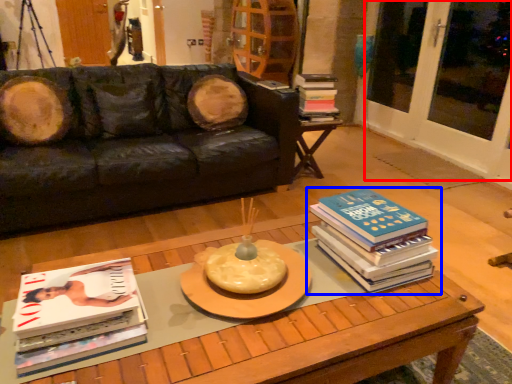
Question: Which object appears closest to the camera in this image, screen door (highlighted by a red box) or book (highlighted by a blue box)?

Choices:
 (A) screen door
 (B) book

Answer: (B)